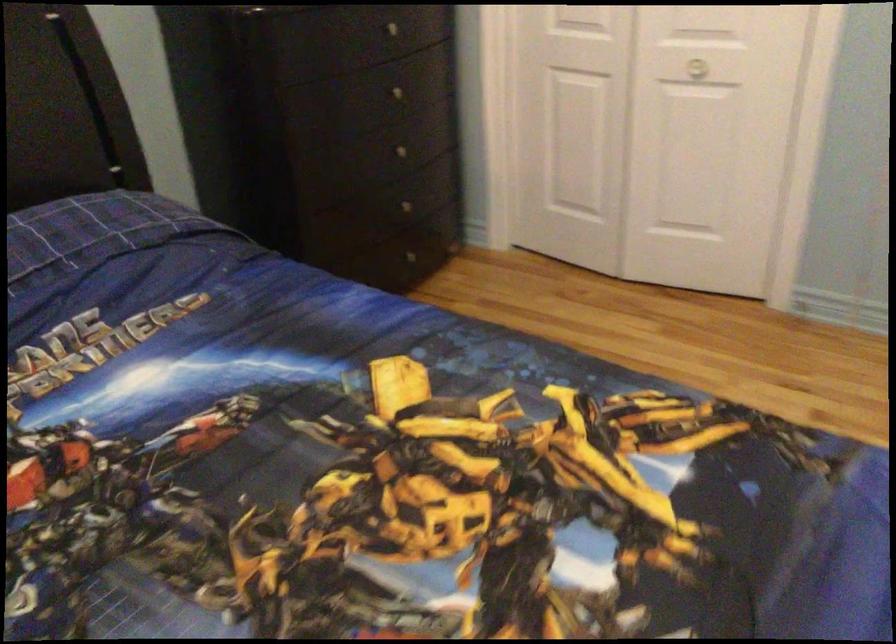
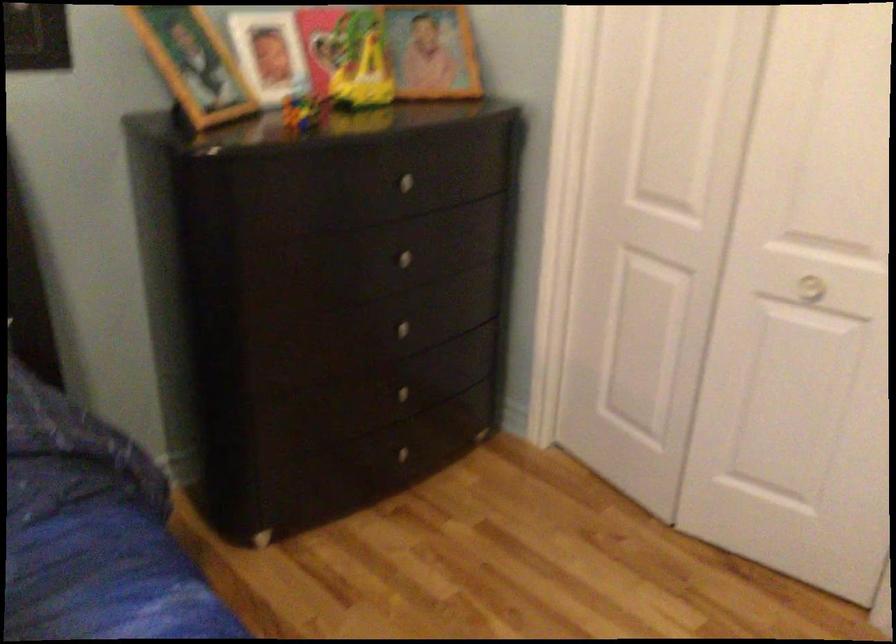
Find the pixel in the second image that matches (x=406, y=155) in the first image.

(409, 332)